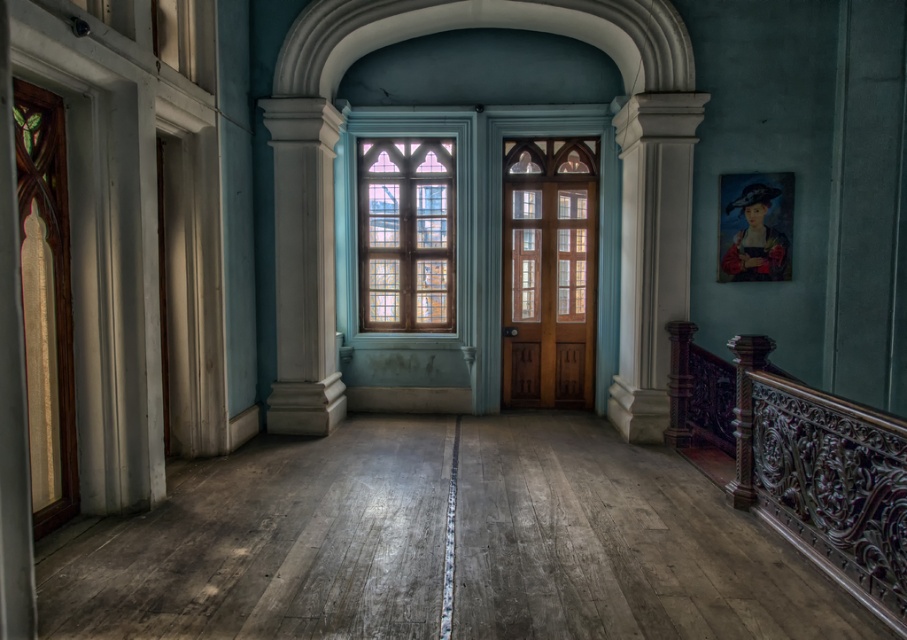
Question: Does wooden door at center have a larger size compared to stained glass window at center?

Choices:
 (A) no
 (B) yes

Answer: (B)

Question: Which object appears closest to the camera in this image?

Choices:
 (A) wooden door at center
 (B) dark wood carved railing at right

Answer: (B)

Question: Where is dark wood carved railing at right located in relation to wooden door at center in the image?

Choices:
 (A) above
 (B) below

Answer: (B)

Question: Which point is farther to the camera?

Choices:
 (A) dark wood carved railing at right
 (B) wooden door at center

Answer: (B)

Question: Based on their relative distances, which object is farther from the stained glass window at center?

Choices:
 (A) dark wood carved railing at right
 (B) wooden door at center

Answer: (A)

Question: Can you confirm if wooden door at center is positioned above stained glass window at center?

Choices:
 (A) yes
 (B) no

Answer: (B)